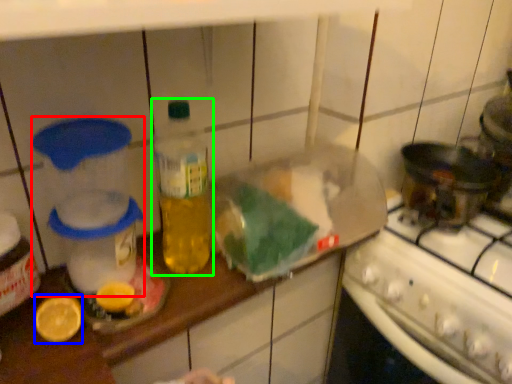
Question: Which is farther away from appliance (highlighted by a red box)? lemon (highlighted by a blue box) or bottle (highlighted by a green box)?

Choices:
 (A) lemon
 (B) bottle

Answer: (A)